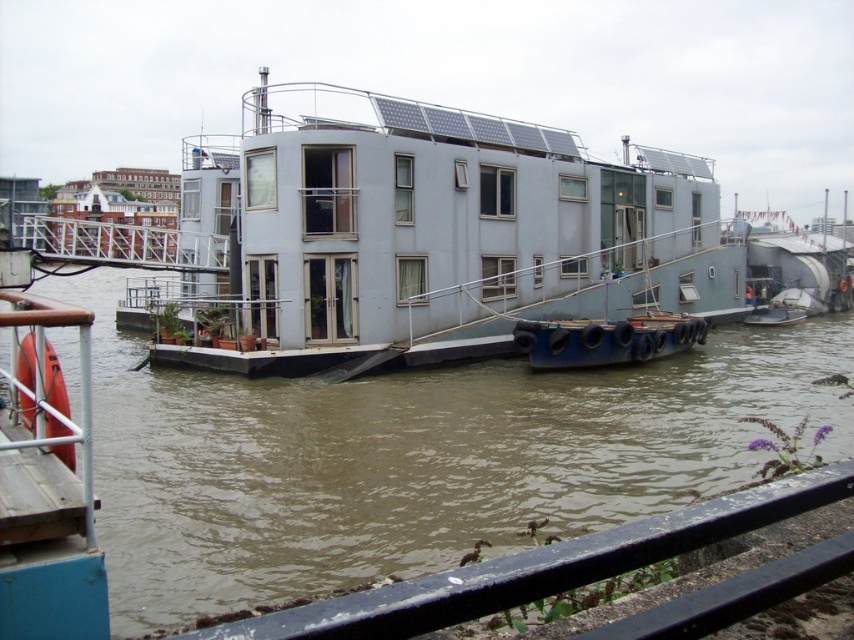
Which is more to the right, brown murky water at center or light gray concrete houseboat at center?

A: Positioned to the right is brown murky water at center.

Which is above, brown murky water at center or light gray concrete houseboat at center?

Positioned higher is light gray concrete houseboat at center.

Locate an element on the screen. brown murky water at center is located at coordinates (410, 458).

The image size is (854, 640). I want to click on brown murky water at center, so click(x=410, y=458).